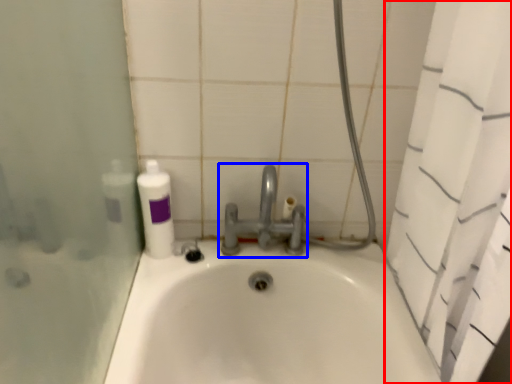
Question: Which object is closer to the camera taking this photo, shower curtain (highlighted by a red box) or tap (highlighted by a blue box)?

Choices:
 (A) shower curtain
 (B) tap

Answer: (A)